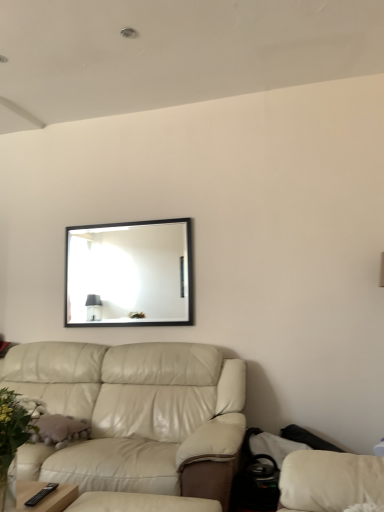
Question: From a real-world perspective, relative to black framed mirror at upper center, is leather couch at lower left vertically above or below?

Choices:
 (A) below
 (B) above

Answer: (A)

Question: Considering the positions of leather couch at lower left and black framed mirror at upper center in the image, is leather couch at lower left bigger or smaller than black framed mirror at upper center?

Choices:
 (A) big
 (B) small

Answer: (A)

Question: Which object is the farthest from the green leafy plant at lower left?

Choices:
 (A) black framed mirror at upper center
 (B) leather couch at lower left

Answer: (A)

Question: Which object is the closest to the leather couch at lower left?

Choices:
 (A) green leafy plant at lower left
 (B) black framed mirror at upper center

Answer: (A)